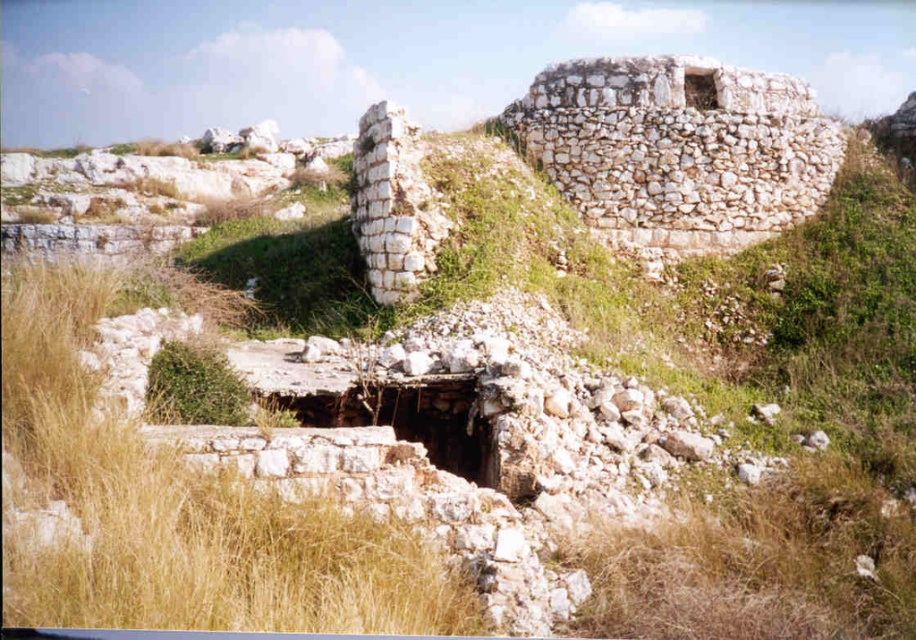
Question: Is dry grass at center to the left of white stone wall at center from the viewer's perspective?

Choices:
 (A) no
 (B) yes

Answer: (B)

Question: Among these points, which one is nearest to the camera?

Choices:
 (A) (416, 186)
 (B) (319, 525)

Answer: (B)

Question: Which object is farther from the camera taking this photo?

Choices:
 (A) white stone wall at center
 (B) dry grass at center

Answer: (A)

Question: Is dry grass at center smaller than white stone wall at center?

Choices:
 (A) yes
 (B) no

Answer: (B)

Question: Considering the relative positions of dry grass at center and white stone wall at center in the image provided, where is dry grass at center located with respect to white stone wall at center?

Choices:
 (A) above
 (B) below

Answer: (B)